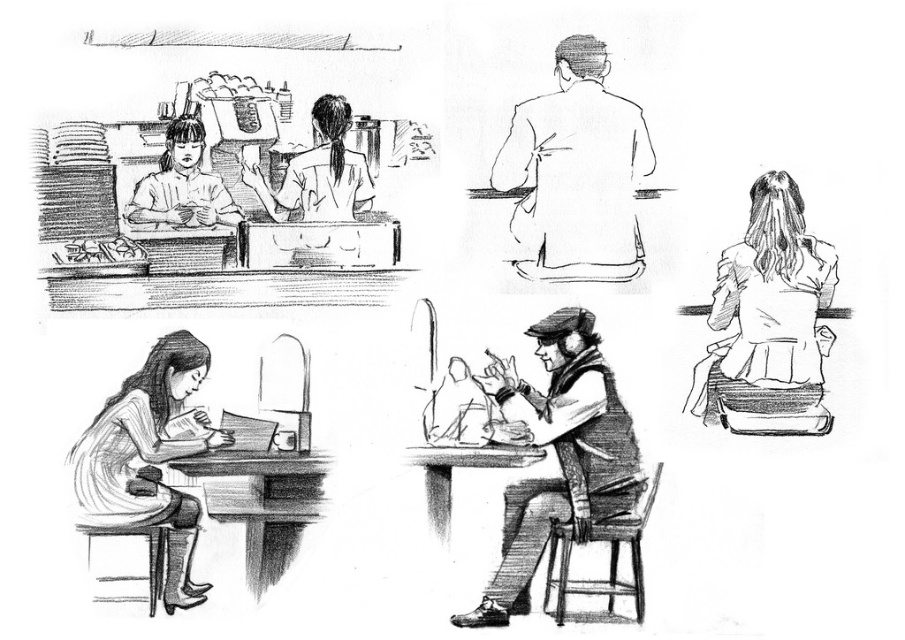
You are standing at the entrance of the cafe and want to greet the man in the white matte jacket at upper right. According to the sketch, where should you walk towards?

The white matte jacket at upper right is located at point (768, 321), so you should walk towards the upper right quadrant of the image to greet the man in the white matte jacket at upper right.